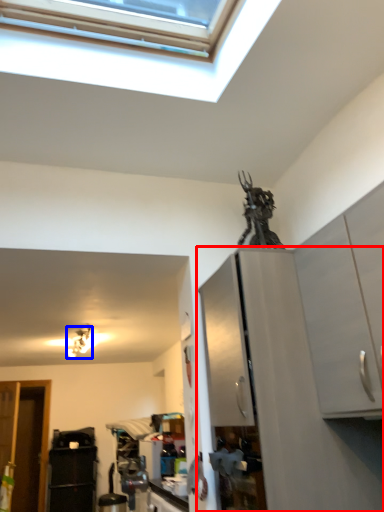
Question: Which object is further to the camera taking this photo, cabinetry (highlighted by a red box) or light fixture (highlighted by a blue box)?

Choices:
 (A) cabinetry
 (B) light fixture

Answer: (B)